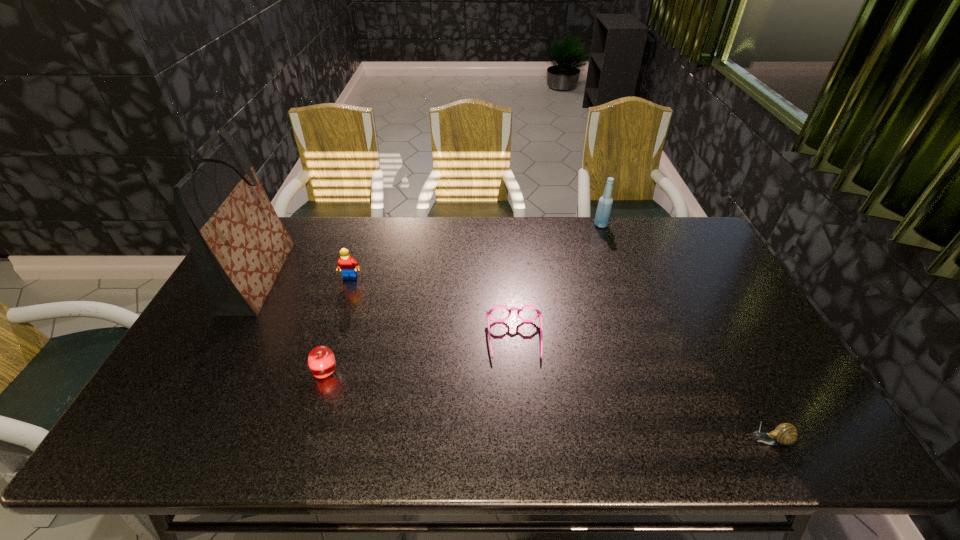
Where is `free space located on the left of the second tallest object`? free space located on the left of the second tallest object is located at coordinates (491, 225).

What are the coordinates of `free region located 0.110m on the front-facing side of the Lego` in the screenshot? It's located at (x=342, y=305).

Where is `free space located 0.090m on the right of the third shortest object`? Image resolution: width=960 pixels, height=540 pixels. free space located 0.090m on the right of the third shortest object is located at coordinates (373, 373).

In order to click on vacant area situated on the arms of the spectacles in this screenshot , I will do `click(521, 430)`.

You are a GUI agent. You are given a task and a screenshot of the screen. Output one action in this format:
    pyautogui.click(x=<x>, y=<y>)
    Task: Click on the vacant space located 0.280m on the front-facing side of the nearest object
    The width and height of the screenshot is (960, 540).
    Given the screenshot: What is the action you would take?
    pyautogui.click(x=621, y=441)

Image resolution: width=960 pixels, height=540 pixels. I want to click on vacant point located on the front-facing side of the nearest object, so click(x=603, y=441).

Where is `free space located 0.280m on the front-facing side of the nearest object`? This screenshot has height=540, width=960. free space located 0.280m on the front-facing side of the nearest object is located at coordinates (621, 441).

Find the location of a particular element. The width and height of the screenshot is (960, 540). shopping bag at the far edge is located at coordinates (240, 245).

Where is `bottle that is at the far edge`? The height and width of the screenshot is (540, 960). bottle that is at the far edge is located at coordinates (603, 212).

Find the location of `object that is at the near edge`. object that is at the near edge is located at coordinates (x=784, y=434).